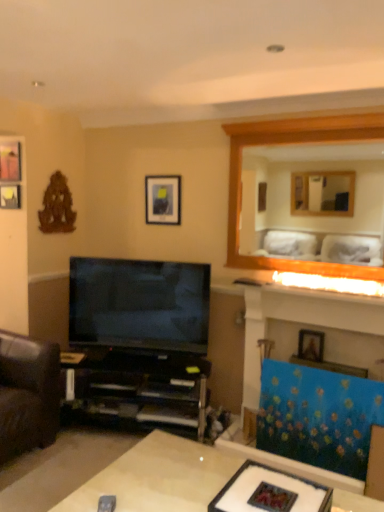
This screenshot has height=512, width=384. In order to click on free space above matte glass frame at center (from a real-world perspective) in this screenshot , I will do `click(272, 486)`.